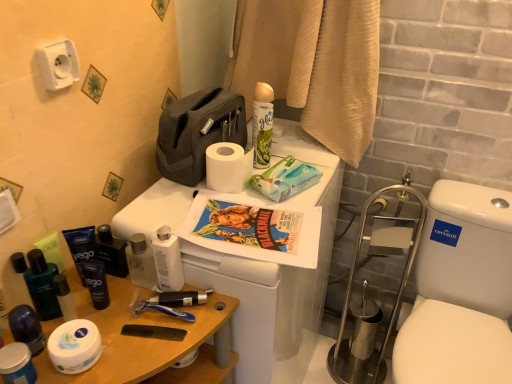
The height and width of the screenshot is (384, 512). In order to click on vacant space to the right of matte white jar at lower left, placed as the third toiletry when sorted from left to right in this screenshot , I will do `click(135, 348)`.